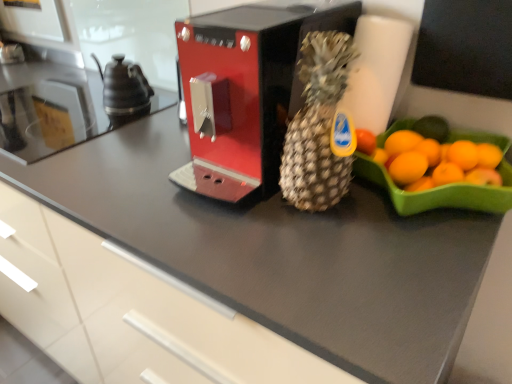
Identify the location of vacant position to the left of brown textured pineapple at center. This screenshot has height=384, width=512. (226, 209).